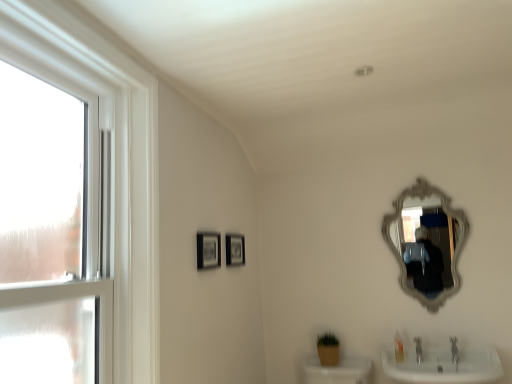
Question: From the image's perspective, is translucent plastic soap at lower right positioned above or below clear glass window at left?

Choices:
 (A) above
 (B) below

Answer: (B)

Question: In terms of size, does translucent plastic soap at lower right appear bigger or smaller than clear glass window at left?

Choices:
 (A) small
 (B) big

Answer: (A)

Question: Estimate the real-world distances between objects in this image. Which object is closer to the translucent plastic soap at lower right?

Choices:
 (A) clear glass window at left
 (B) matte black picture frame at center, the 1th picture frame when ordered from right to left
 (C) silver/gilded ornate mirror at upper right
 (D) matte black picture frame at center, the first picture frame viewed from the front

Answer: (C)

Question: Which object is positioned closest to the translucent plastic soap at lower right?

Choices:
 (A) matte black picture frame at center, which ranks as the 2th picture frame in front-to-back order
 (B) clear glass window at left
 (C) silver/gilded ornate mirror at upper right
 (D) matte black picture frame at center, which ranks as the 2th picture frame in right-to-left order

Answer: (C)